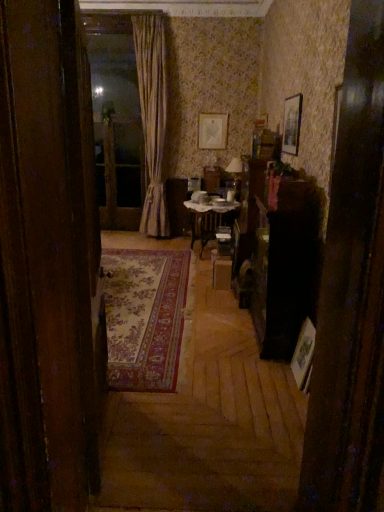
Question: Considering their positions, is wooden picture frame at right, which appears as the 1th picture frame when ordered from the bottom, located in front of or behind wooden picture frame at upper right, which is counted as the third picture frame, starting from the left?

Choices:
 (A) front
 (B) behind

Answer: (A)

Question: Based on their sizes in the image, would you say wooden picture frame at right, the 3th picture frame from the back, is bigger or smaller than wooden picture frame at upper right, the 2th picture frame viewed from the top?

Choices:
 (A) big
 (B) small

Answer: (B)

Question: Estimate the real-world distances between objects in this image. Which object is farther from the wooden table at center?

Choices:
 (A) wooden picture frame at right, arranged as the third picture frame when viewed from the top
 (B) matte gold picture frame at upper center, placed as the first picture frame when sorted from left to right
 (C) transparent glass screen door at upper center
 (D) gold textured curtain at center
 (E) wooden picture frame at upper right, which appears as the 2th picture frame when viewed from the front

Answer: (A)

Question: Estimate the real-world distances between objects in this image. Which object is farther from the wooden picture frame at upper right, arranged as the 2th picture frame when viewed from the back?

Choices:
 (A) wooden picture frame at right, placed as the 2th picture frame when sorted from right to left
 (B) wooden door at left
 (C) gold textured curtain at center
 (D) matte gold picture frame at upper center, which is the first picture frame in top-to-bottom order
 (E) wooden table at center

Answer: (B)